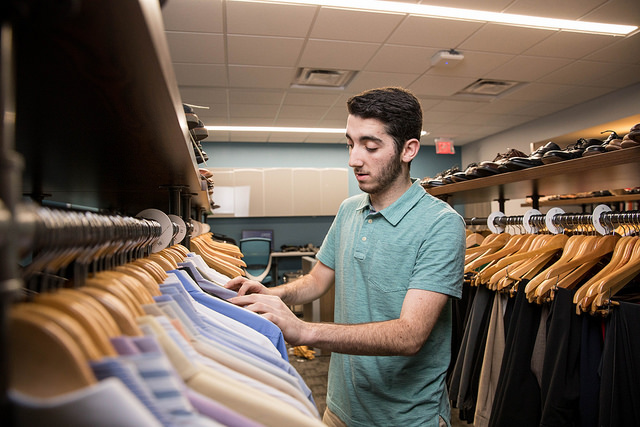
At what (x,y) coordinates should I click in order to perform the action: click on lights. Please return your answer as a coordinate pair (x, y). Looking at the image, I should click on (268, 129).